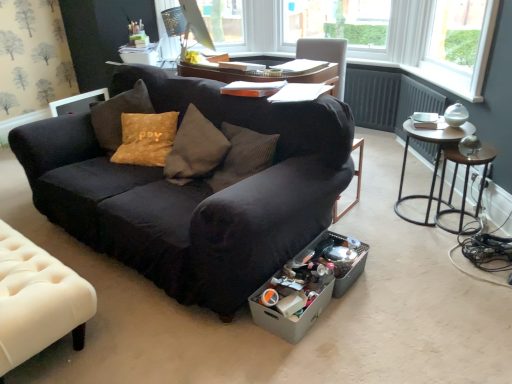
I want to click on free region under metallic round table at right (from a real-world perspective), so click(x=414, y=210).